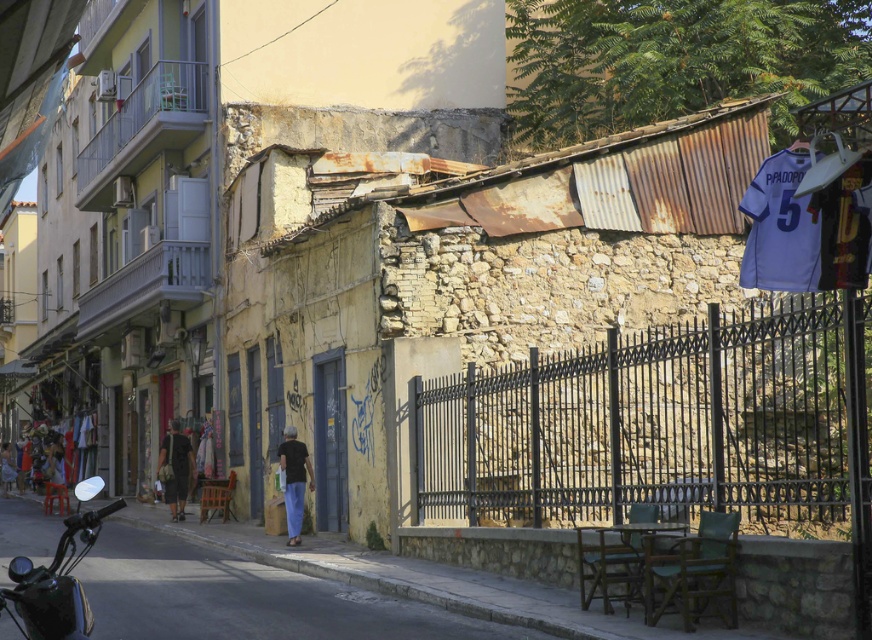
You are a delivery person who needs to park your shiny black motorcycle at lower left near the black matte shirt at center. Since the motorcycle is larger, will it block the view of the shirt from the street?

The shiny black motorcycle at lower left is larger than the black matte shirt at center, so parking it near the shirt may block its view from the street depending on their exact positions.

You are a delivery person who needs to park your motorcycle. You see a shiny black motorcycle at lower left and a black matte shirt at center. Which object is wider so you can choose the appropriate parking space?

The shiny black motorcycle at lower left is wider than the black matte shirt at center, so you should choose the parking space that accommodates the motorcycle.